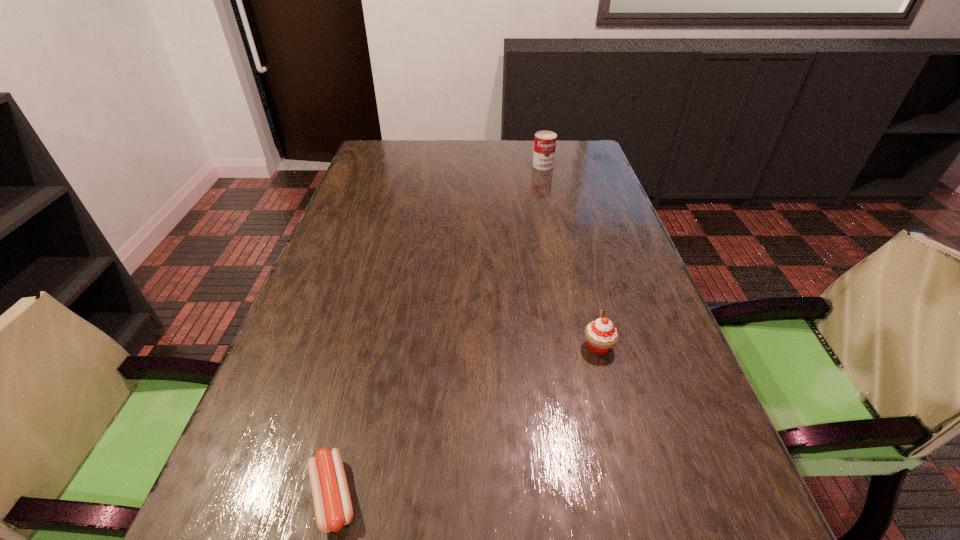
Where is `free location that satisfies the following two spatial constraints: 1. on the front label of the cupcake; 2. on the left side of the can`? This screenshot has height=540, width=960. free location that satisfies the following two spatial constraints: 1. on the front label of the cupcake; 2. on the left side of the can is located at coordinates (585, 346).

Identify the location of free spot that satisfies the following two spatial constraints: 1. on the front label of the tallest object; 2. on the left side of the second tallest object. (585, 346).